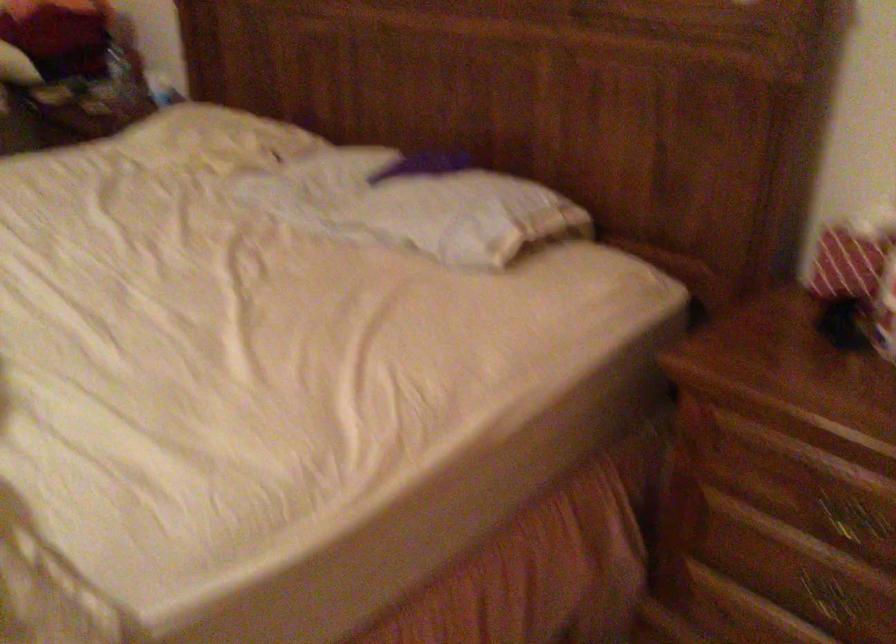
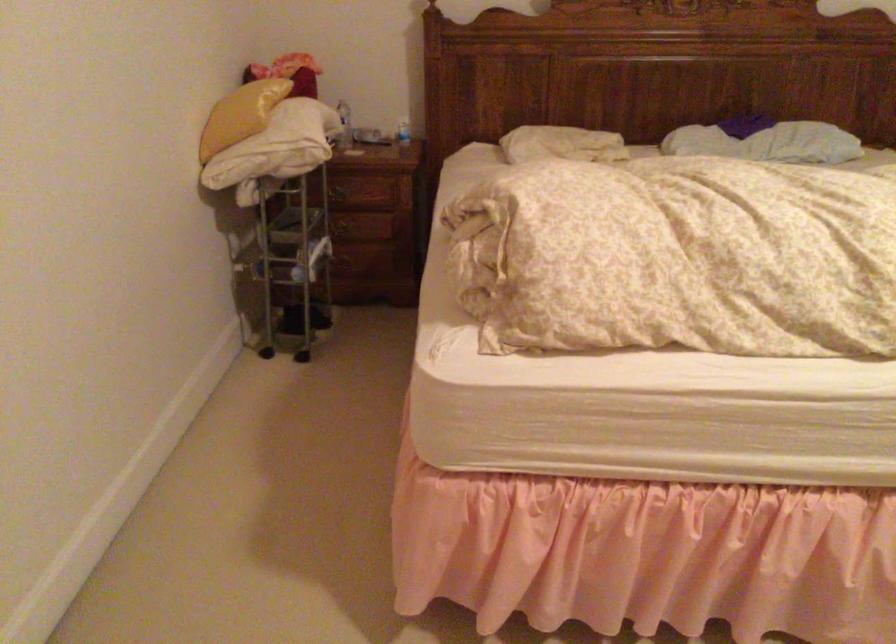
In the second image, find the point that corresponds to the point at 73,140 in the first image.

(338, 194)